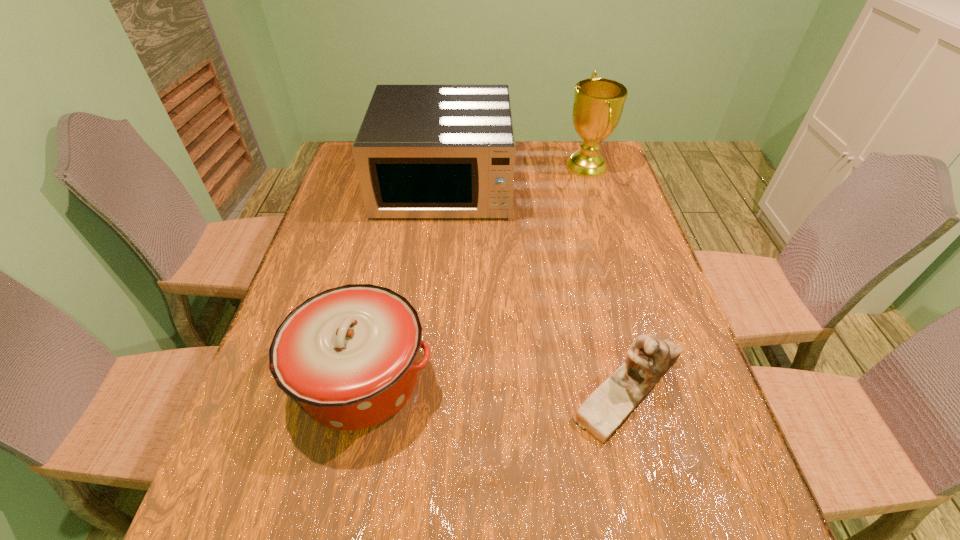
Locate an element on the screen. Image resolution: width=960 pixels, height=540 pixels. award is located at coordinates (598, 104).

Find the location of a particular element. microwave oven is located at coordinates (422, 151).

Find the location of a particular element. Image resolution: width=960 pixels, height=540 pixels. the second shortest object is located at coordinates (349, 354).

This screenshot has width=960, height=540. I want to click on the shortest object, so click(648, 359).

Find the location of a particular element. This screenshot has width=960, height=540. free space located 0.280m on the shiny surface of the award is located at coordinates (481, 167).

Locate an element on the screen. The height and width of the screenshot is (540, 960). vacant region located 0.370m on the shiny surface of the award is located at coordinates (454, 167).

Locate an element on the screen. This screenshot has height=540, width=960. blank area located 0.330m on the shiny surface of the award is located at coordinates (467, 167).

Locate an element on the screen. This screenshot has width=960, height=540. vacant region located with the door open on the microwave oven is located at coordinates (437, 246).

Locate an element on the screen. Image resolution: width=960 pixels, height=540 pixels. vacant space located on the back of the second shortest object is located at coordinates (382, 279).

Where is `vacant space located 0.250m on the front-facing side of the figurine`? This screenshot has height=540, width=960. vacant space located 0.250m on the front-facing side of the figurine is located at coordinates (446, 388).